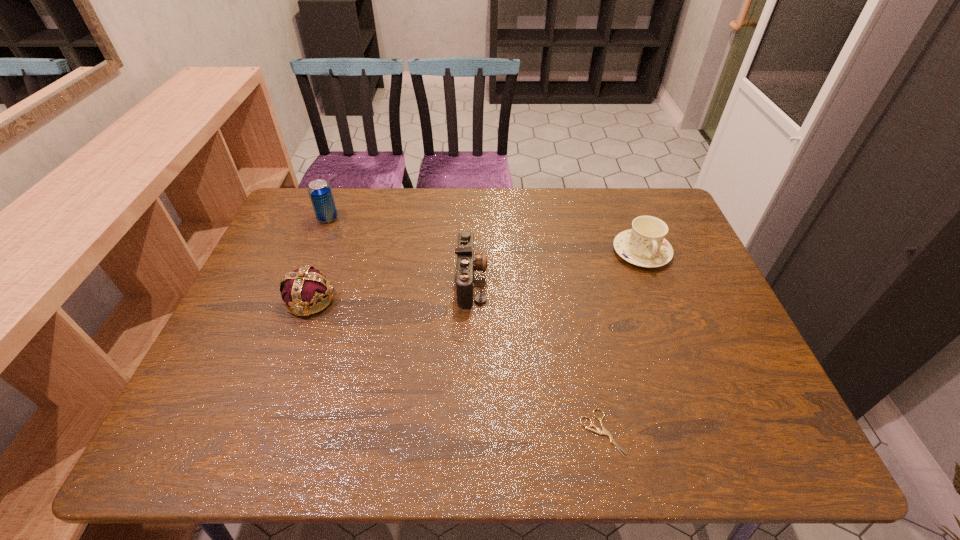
This screenshot has height=540, width=960. I want to click on free spot between the shortest object and the crown, so click(x=456, y=366).

You are a GUI agent. You are given a task and a screenshot of the screen. Output one action in this format:
    pyautogui.click(x=<x>, y=<y>)
    Task: Click on the empty space between the chinaware and the tallest object
    
    Given the screenshot: What is the action you would take?
    pyautogui.click(x=485, y=235)

Locate an element on the screen. The image size is (960, 540). free space between the chinaware and the shortest object is located at coordinates (621, 342).

I want to click on the third closest object to the chinaware, so pyautogui.click(x=306, y=286).

This screenshot has width=960, height=540. What are the coordinates of `object that is the third nearest to the crown` in the screenshot? It's located at (604, 431).

Where is `free point that satisfies the following two spatial constraints: 1. on the front-facing side of the camera; 2. on the front side of the crown`? This screenshot has height=540, width=960. free point that satisfies the following two spatial constraints: 1. on the front-facing side of the camera; 2. on the front side of the crown is located at coordinates pyautogui.click(x=471, y=299).

This screenshot has width=960, height=540. In order to click on free space that satisfies the following two spatial constraints: 1. on the handle side of the chinaware; 2. on the front-facing side of the third object from right to left in this screenshot , I will do `click(653, 280)`.

This screenshot has width=960, height=540. Identify the location of free space in the image that satisfies the following two spatial constraints: 1. on the front side of the beer can; 2. on the right side of the shears. (243, 433).

I want to click on vacant space that satisfies the following two spatial constraints: 1. on the handle side of the rightmost object; 2. on the front-facing side of the third object from right to left, so click(653, 280).

Locate an element on the screen. free space in the image that satisfies the following two spatial constraints: 1. on the front-facing side of the third object from right to left; 2. on the front side of the crown is located at coordinates (471, 299).